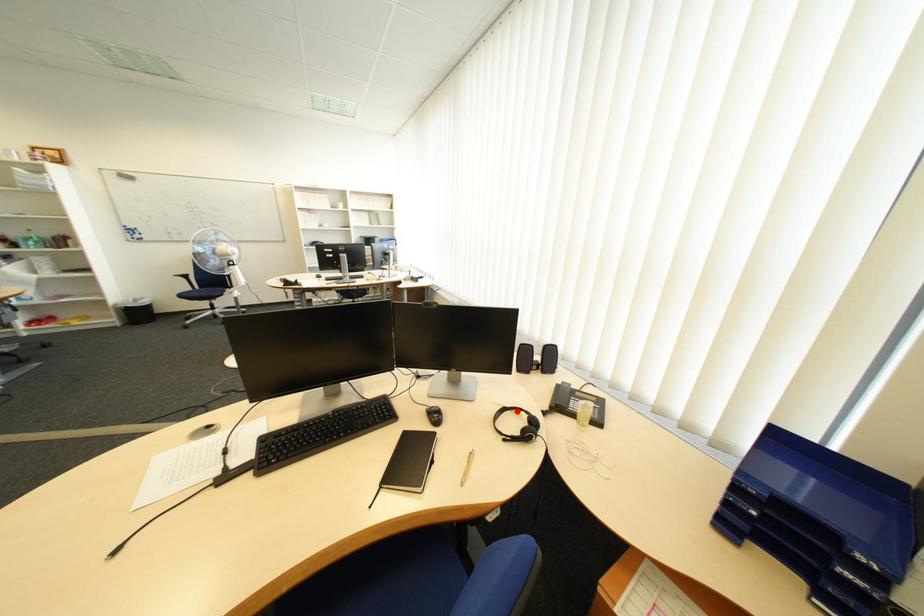
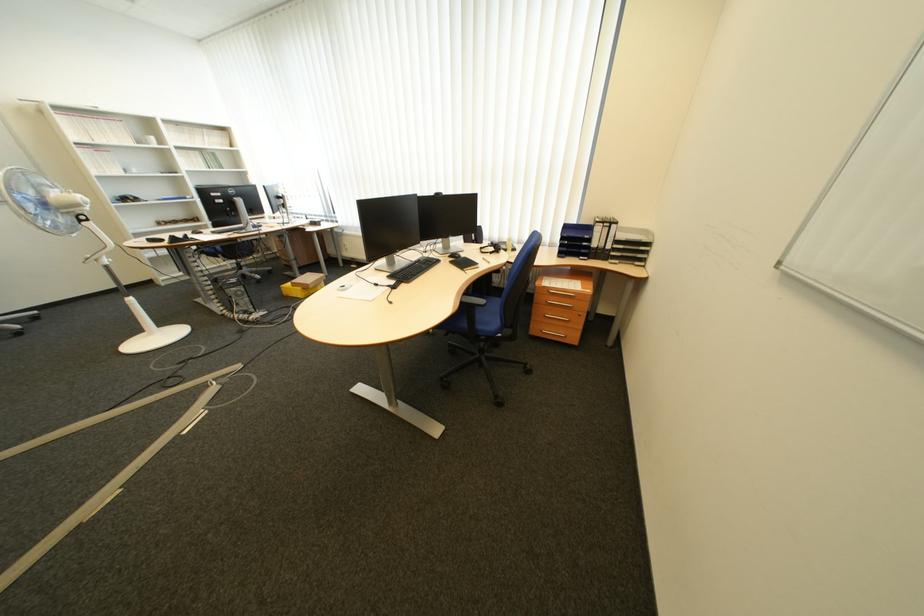
Locate, in the second image, the point that corresponds to the highlighted location in the first image.

(494, 249)